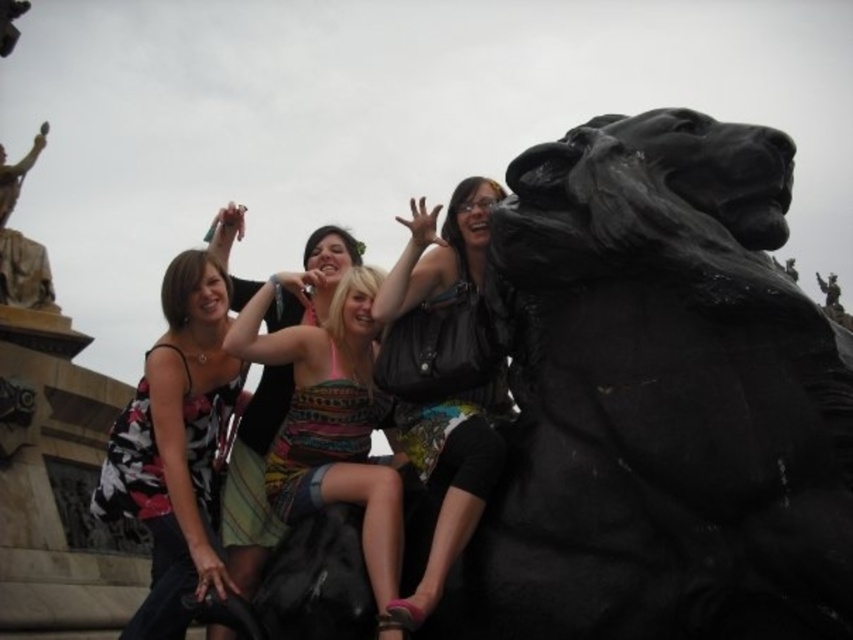
Who is positioned more to the right, patterned fabric dress at center or bronze statue at upper left?

Positioned to the right is patterned fabric dress at center.

I want to click on patterned fabric dress at center, so click(x=329, y=419).

Locate an element on the screen. The height and width of the screenshot is (640, 853). patterned fabric dress at center is located at coordinates (329, 419).

Can you confirm if patterned fabric dress at center is thinner than leather jacket at right?

No.

Looking at this image, does patterned fabric dress at center have a lesser height compared to leather jacket at right?

Correct, patterned fabric dress at center is not as tall as leather jacket at right.

Which is behind, point (321, 451) or point (454, 276)?

The point (454, 276) is behind.

Identify the location of patterned fabric dress at center. Image resolution: width=853 pixels, height=640 pixels. (329, 419).

Is leather jacket at right smaller than bronze statue at upper left?

Indeed, leather jacket at right has a smaller size compared to bronze statue at upper left.

Is point (428, 220) farther from viewer compared to point (10, 282)?

No, it is not.

I want to click on leather jacket at right, so click(x=451, y=477).